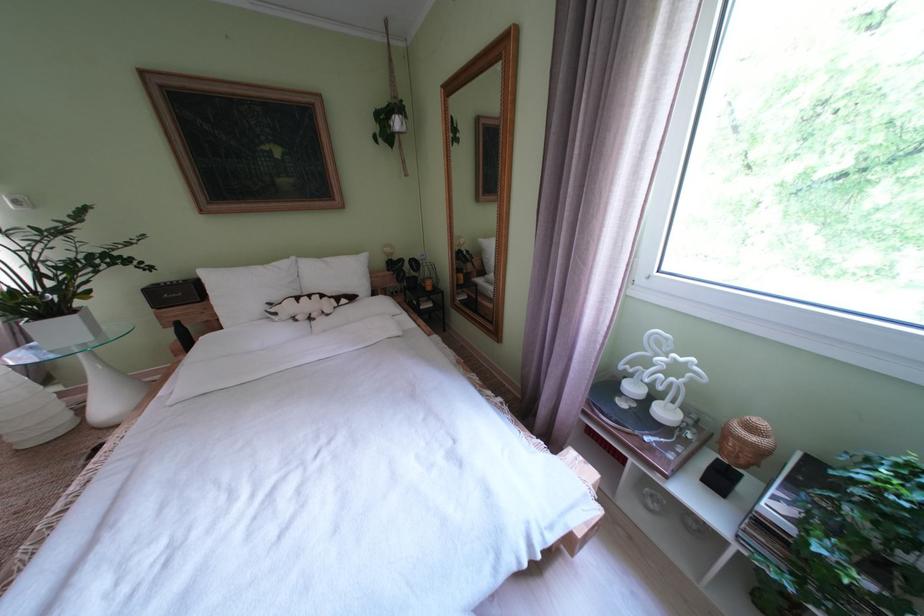
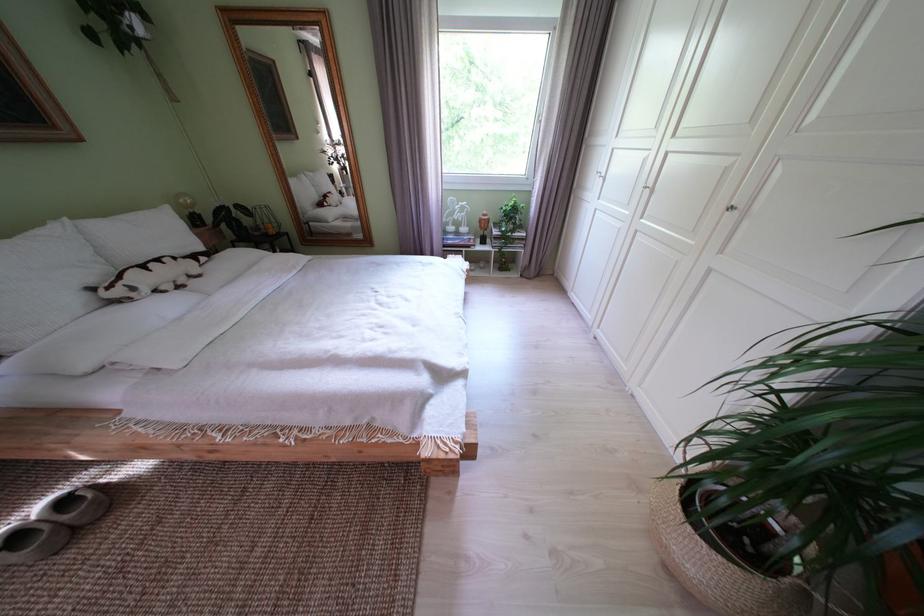
In the second image, find the point that corresponds to the point at 286,318 in the first image.

(146, 294)